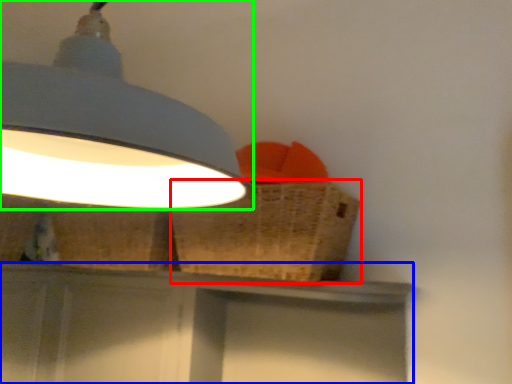
Question: Which object is the closest to the basket (highlighted by a red box)? Choose among these: vanity (highlighted by a blue box) or lamp (highlighted by a green box).

Choices:
 (A) vanity
 (B) lamp

Answer: (A)